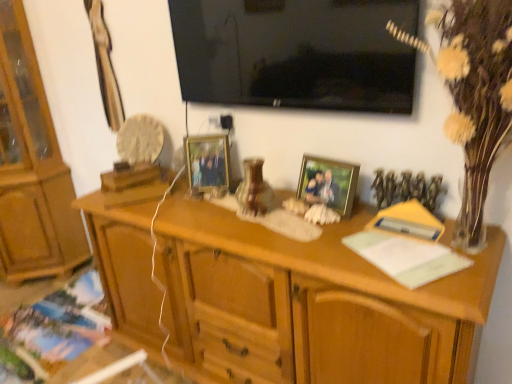
Question: From the image's perspective, is yellow paper at right, which is counted as the 2th book, starting from the back, on white textured vase at right?

Choices:
 (A) no
 (B) yes

Answer: (A)

Question: From a real-world perspective, does yellow paper at right, arranged as the 2th book when viewed from the front, stand above white textured vase at right?

Choices:
 (A) yes
 (B) no

Answer: (B)

Question: Is white textured vase at right surrounded by yellow paper at right, which ranks as the third book in left-to-right order?

Choices:
 (A) no
 (B) yes

Answer: (A)

Question: Is yellow paper at right, which ranks as the third book in left-to-right order, taller than white textured vase at right?

Choices:
 (A) yes
 (B) no

Answer: (B)

Question: Does yellow paper at right, which ranks as the third book in left-to-right order, have a lesser height compared to white textured vase at right?

Choices:
 (A) no
 (B) yes

Answer: (B)

Question: Looking at their shapes, would you say metallic gold picture frame at center, the second picture frame positioned from the left, is wider or thinner than matte wooden picture frame at center, arranged as the second picture frame when viewed from the right?

Choices:
 (A) wide
 (B) thin

Answer: (B)

Question: Considering their positions, is metallic gold picture frame at center, the second picture frame positioned from the left, located in front of or behind matte wooden picture frame at center, arranged as the second picture frame when viewed from the right?

Choices:
 (A) behind
 (B) front

Answer: (B)

Question: Is point tap(343, 188) positioned closer to the camera than point tap(192, 165)?

Choices:
 (A) farther
 (B) closer

Answer: (B)

Question: Considering the positions of metallic gold picture frame at center, which is counted as the 1th picture frame, starting from the right, and matte wooden picture frame at center, marked as the first picture frame in a back-to-front arrangement, in the image, is metallic gold picture frame at center, which is counted as the 1th picture frame, starting from the right, taller or shorter than matte wooden picture frame at center, marked as the first picture frame in a back-to-front arrangement,?

Choices:
 (A) short
 (B) tall

Answer: (A)

Question: In terms of size, does wooden desk at center appear bigger or smaller than light brown wood cabinet at left?

Choices:
 (A) big
 (B) small

Answer: (A)

Question: Is wooden desk at center in front of or behind light brown wood cabinet at left in the image?

Choices:
 (A) behind
 (B) front

Answer: (B)

Question: From the image's perspective, is wooden desk at center located above or below light brown wood cabinet at left?

Choices:
 (A) below
 (B) above

Answer: (A)

Question: Considering the positions of wooden desk at center and light brown wood cabinet at left in the image, is wooden desk at center wider or thinner than light brown wood cabinet at left?

Choices:
 (A) wide
 (B) thin

Answer: (A)

Question: Based on their sizes in the image, would you say white textured vase at right is bigger or smaller than matte paper book at lower left, which ranks as the 1th book in left-to-right order?

Choices:
 (A) small
 (B) big

Answer: (B)

Question: From a real-world perspective, relative to matte paper book at lower left, acting as the third book starting from the top, is white textured vase at right vertically above or below?

Choices:
 (A) above
 (B) below

Answer: (A)